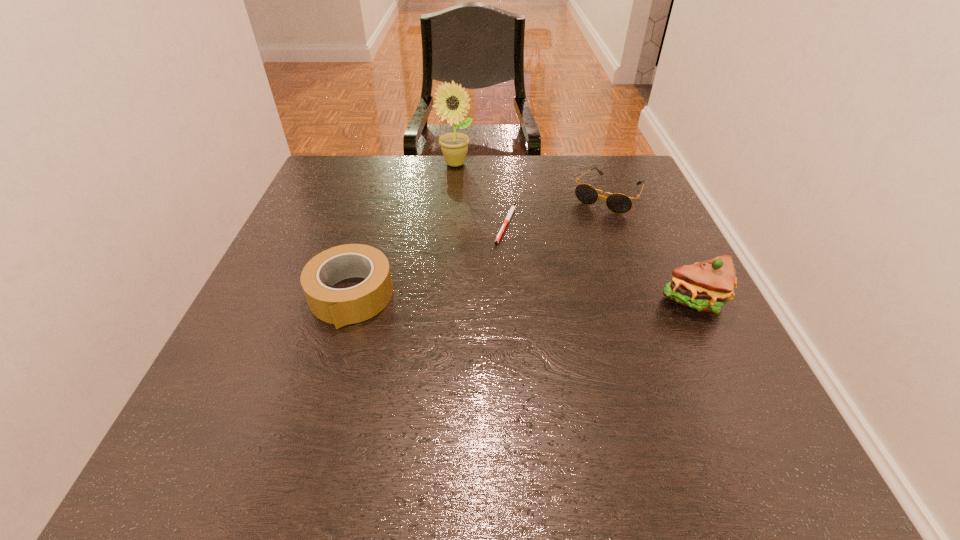
The height and width of the screenshot is (540, 960). What are the coordinates of `object that is the nearest to the sunflower` in the screenshot? It's located at (512, 208).

Identify the location of free spot that satisfies the following two spatial constraints: 1. on the front side of the fourth shortest object; 2. on the right side of the shortest object. The image size is (960, 540). (512, 300).